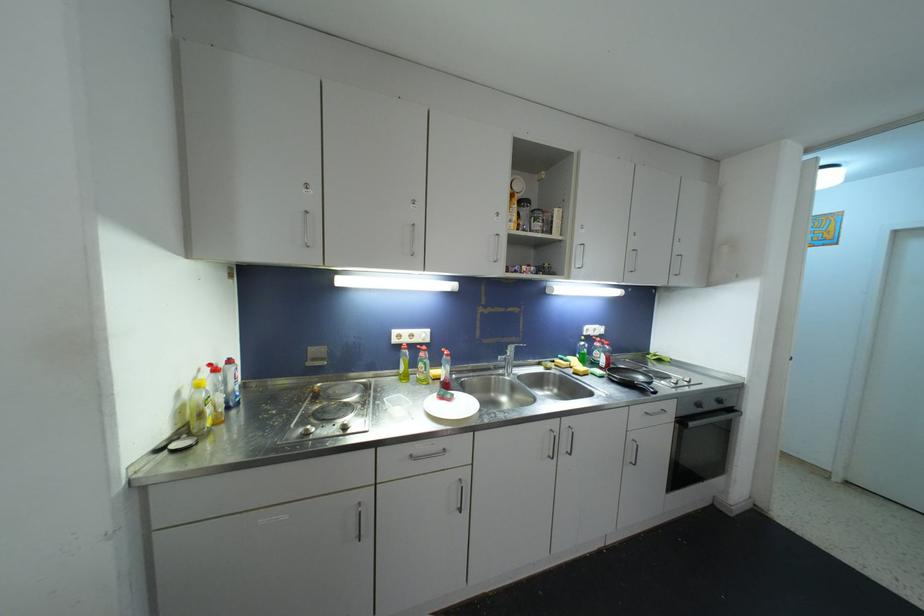
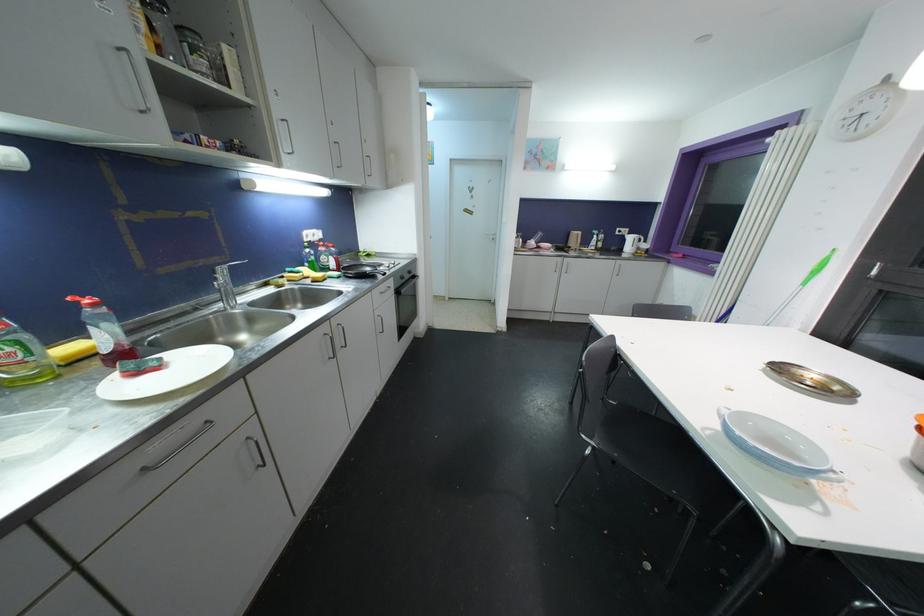
The point at (633, 440) is marked in the first image. Where is the corresponding point in the second image?

(379, 318)